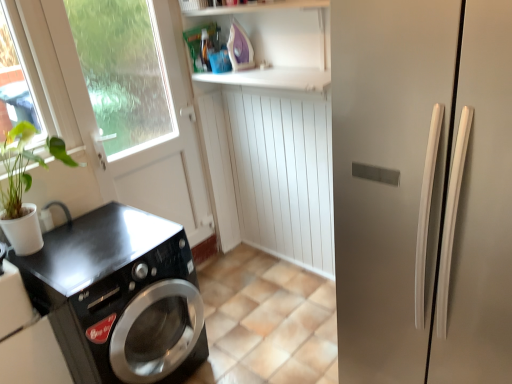
What do you see at coordinates (239, 48) in the screenshot? I see `purple plastic iron at upper center` at bounding box center [239, 48].

Where is `black glossy screen door at left`? The width and height of the screenshot is (512, 384). black glossy screen door at left is located at coordinates (148, 119).

This screenshot has width=512, height=384. Describe the element at coordinates (119, 296) in the screenshot. I see `black glossy washing machine at lower left` at that location.

The height and width of the screenshot is (384, 512). I want to click on black glossy washing machine at lower left, so click(x=119, y=296).

I want to click on purple plastic iron at upper center, so click(x=239, y=48).

How distant is purple plastic iron at upper center from black glossy screen door at left?

The distance of purple plastic iron at upper center from black glossy screen door at left is 66.17 centimeters.

Is point (230, 28) closer to viewer compared to point (190, 117)?

That is True.

Does purple plastic iron at upper center turn towards black glossy screen door at left?

No, purple plastic iron at upper center is not facing towards black glossy screen door at left.

Which of these two, purple plastic iron at upper center or black glossy screen door at left, stands shorter?

purple plastic iron at upper center.

Who is bigger, black glossy washing machine at lower left or purple plastic iron at upper center?

black glossy washing machine at lower left.

Is black glossy washing machine at lower left closer to the viewer compared to purple plastic iron at upper center?

Yes, black glossy washing machine at lower left is in front of purple plastic iron at upper center.

Considering the relative sizes of black glossy washing machine at lower left and purple plastic iron at upper center in the image provided, is black glossy washing machine at lower left wider than purple plastic iron at upper center?

Correct, the width of black glossy washing machine at lower left exceeds that of purple plastic iron at upper center.

Which is more distant, (139, 286) or (242, 61)?

Positioned behind is point (242, 61).

Can you tell me how much black glossy washing machine at lower left and satin silver refrigerator at right differ in facing direction?

They differ by 89.9 degrees in their facing directions.

From a real-world perspective, is black glossy washing machine at lower left above or below satin silver refrigerator at right?

From a real-world perspective, black glossy washing machine at lower left is physically below satin silver refrigerator at right.

How much distance is there between black glossy washing machine at lower left and satin silver refrigerator at right?

black glossy washing machine at lower left and satin silver refrigerator at right are 5.01 feet apart.

From the image's perspective, is black glossy washing machine at lower left below satin silver refrigerator at right?

Indeed, from the image's perspective, black glossy washing machine at lower left is shown beneath satin silver refrigerator at right.

Is black glossy screen door at left positioned beyond the bounds of black glossy washing machine at lower left?

black glossy screen door at left is positioned outside black glossy washing machine at lower left.

Is black glossy screen door at left to the left of black glossy washing machine at lower left from the viewer's perspective?

No.

From a real-world perspective, which is physically below, black glossy screen door at left or black glossy washing machine at lower left?

black glossy washing machine at lower left.

From a real-world perspective, which is physically above, black glossy screen door at left or satin silver refrigerator at right?

black glossy screen door at left.

Is black glossy screen door at left aimed at satin silver refrigerator at right?

Yes, black glossy screen door at left is aimed at satin silver refrigerator at right.

Is black glossy screen door at left touching satin silver refrigerator at right?

No.

Can you tell me how much black glossy screen door at left and satin silver refrigerator at right differ in facing direction?

The angle between the facing direction of black glossy screen door at left and the facing direction of satin silver refrigerator at right is 90.3 degrees.

Where is `home appliance below the black glossy screen door at left (from the image's perspective)`? home appliance below the black glossy screen door at left (from the image's perspective) is located at coordinates 26,338.

From a real-world perspective, which object stands above the other?

black glossy screen door at left is physically above.

Consider the image. Is black glossy washing machine at lower left facing towards black glossy screen door at left?

No, black glossy washing machine at lower left is not aimed at black glossy screen door at left.

Considering the relative sizes of black glossy washing machine at lower left and black glossy screen door at left in the image provided, is black glossy washing machine at lower left taller than black glossy screen door at left?

No, black glossy washing machine at lower left is not taller than black glossy screen door at left.

Would you say satin silver refrigerator at right is a long distance from purple plastic iron at upper center?

Yes, satin silver refrigerator at right and purple plastic iron at upper center are located far from each other.

I want to click on appliance that appears above the satin silver refrigerator at right (from a real-world perspective), so click(x=239, y=48).

From a real-world perspective, relative to purple plastic iron at upper center, is satin silver refrigerator at right vertically above or below?

satin silver refrigerator at right is below purple plastic iron at upper center.

Considering the relative sizes of satin silver refrigerator at right and purple plastic iron at upper center in the image provided, is satin silver refrigerator at right taller than purple plastic iron at upper center?

Correct, satin silver refrigerator at right is much taller as purple plastic iron at upper center.

You are a GUI agent. You are given a task and a screenshot of the screen. Output one action in this format:
    pyautogui.click(x=<x>, y=<y>)
    Task: Click on the appliance above the black glossy screen door at left (from a real-world perspective)
    Image resolution: width=512 pixels, height=384 pixels.
    Given the screenshot: What is the action you would take?
    pyautogui.click(x=239, y=48)

Where is `washing machine on the left of purple plastic iron at upper center`? The height and width of the screenshot is (384, 512). washing machine on the left of purple plastic iron at upper center is located at coordinates (119, 296).

In the scene shown: Considering their positions, is satin silver refrigerator at right positioned closer to black glossy washing machine at lower left than purple plastic iron at upper center?

Among the two, satin silver refrigerator at right is located nearer to black glossy washing machine at lower left.

From the image, which object appears to be farther from black glossy screen door at left, black glossy washing machine at lower left or purple plastic iron at upper center?

black glossy washing machine at lower left.

From the image, which object appears to be nearer to black glossy screen door at left, black glossy washing machine at lower left or satin silver refrigerator at right?

black glossy washing machine at lower left is closer to black glossy screen door at left.

Based on the photo, estimate the real-world distances between objects in this image. Which object is further from black glossy screen door at left, purple plastic iron at upper center or black glossy washing machine at lower left?

black glossy washing machine at lower left lies further to black glossy screen door at left than the other object.

Looking at the image, which one is located closer to black glossy screen door at left, black glossy washing machine at lower left or black glossy washing machine at lower left?

black glossy washing machine at lower left.

Estimate the real-world distances between objects in this image. Which object is closer to purple plastic iron at upper center, black glossy washing machine at lower left or black glossy screen door at left?

Based on the image, black glossy screen door at left appears to be nearer to purple plastic iron at upper center.

When comparing their distances from black glossy washing machine at lower left, does purple plastic iron at upper center or satin silver refrigerator at right seem further?

purple plastic iron at upper center lies further to black glossy washing machine at lower left than the other object.

Considering their positions, is black glossy washing machine at lower left positioned closer to satin silver refrigerator at right than black glossy washing machine at lower left?

Among the two, black glossy washing machine at lower left is located nearer to satin silver refrigerator at right.

Locate an element on the screen. This screenshot has width=512, height=384. appliance between black glossy washing machine at lower left and satin silver refrigerator at right in the horizontal direction is located at coordinates (239, 48).

In order to click on washing machine positioned between satin silver refrigerator at right and purple plastic iron at upper center from near to far in this screenshot , I will do `click(119, 296)`.

Find the location of a particular element. This screenshot has width=512, height=384. screen door situated between black glossy washing machine at lower left and satin silver refrigerator at right from left to right is located at coordinates (148, 119).

Where is `screen door located between satin silver refrigerator at right and purple plastic iron at upper center in the depth direction`? screen door located between satin silver refrigerator at right and purple plastic iron at upper center in the depth direction is located at coordinates (148, 119).